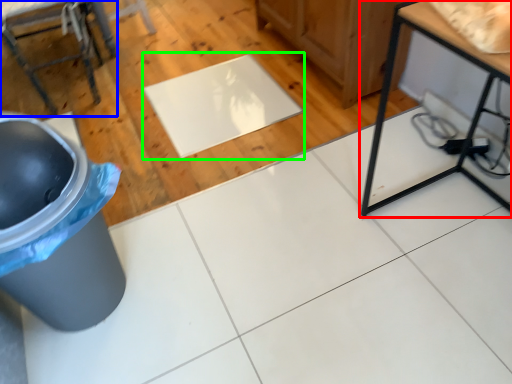
Question: Estimate the real-world distances between objects in this image. Which object is closer to table (highlighted by a red box), furniture (highlighted by a blue box) or mat (highlighted by a green box)?

Choices:
 (A) furniture
 (B) mat

Answer: (B)